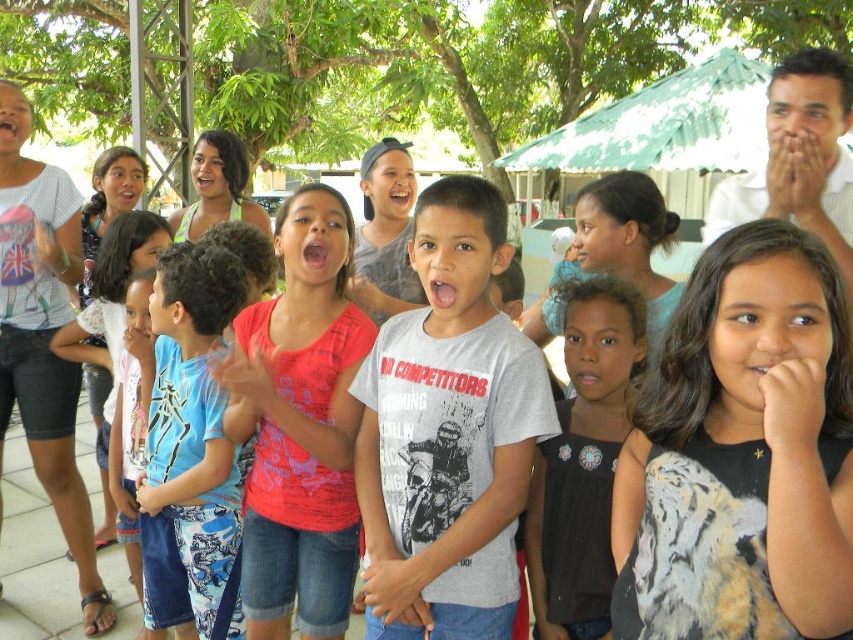
Is gray matte shirt at center to the left of matte pink shirt at center from the viewer's perspective?

In fact, gray matte shirt at center is to the right of matte pink shirt at center.

Does gray matte shirt at center come behind matte pink shirt at center?

No.

What are the coordinates of `gray matte shirt at center` in the screenshot? It's located at (448, 433).

Describe the element at coordinates (448, 433) in the screenshot. I see `gray matte shirt at center` at that location.

Which is more to the right, gray matte shirt at center or black satin blouse at center?

black satin blouse at center

Who is more forward, (x=479, y=624) or (x=593, y=314)?

Point (x=479, y=624) is in front.

In order to click on gray matte shirt at center in this screenshot , I will do `click(448, 433)`.

Who is higher up, matte pink shirt at center or black satin blouse at center?

matte pink shirt at center is above.

Can you confirm if matte pink shirt at center is positioned above black satin blouse at center?

Yes.

In order to click on matte pink shirt at center in this screenshot , I will do tap(300, 424).

I want to click on matte pink shirt at center, so click(x=300, y=424).